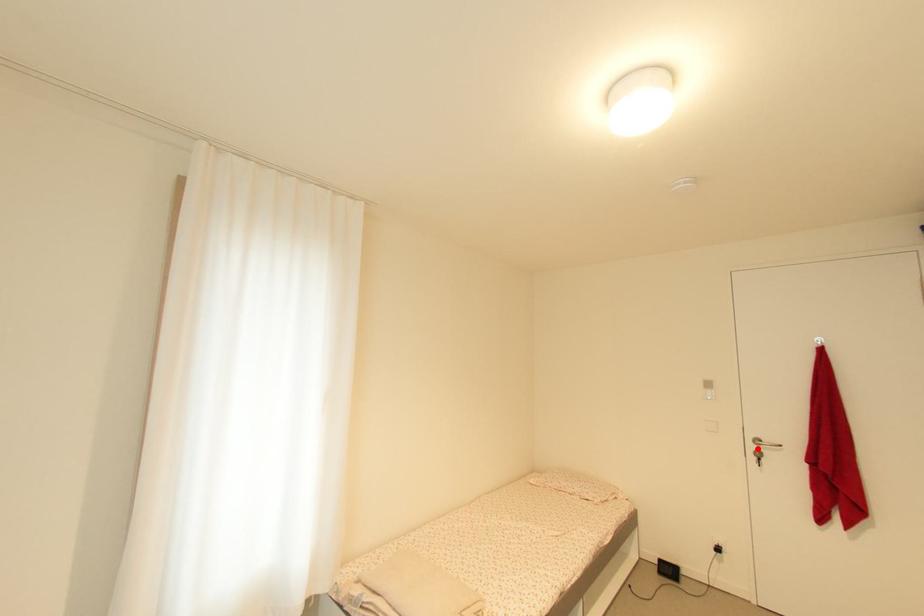
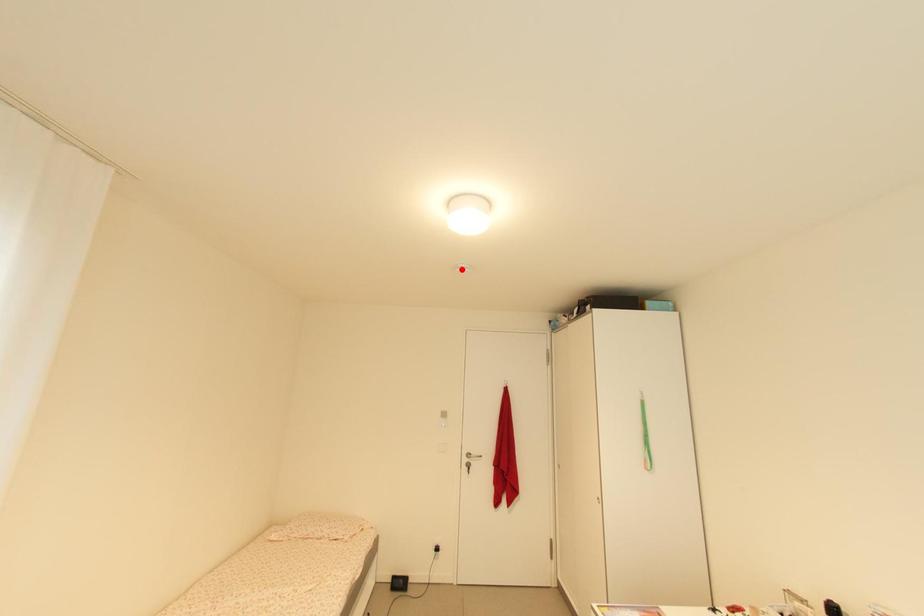
I am providing you with two images of the same scene from different viewpoints. A red point is marked on the first image and another point is marked on the second image. Does the point marked in image1 correspond to the same location as the one in image2?

No